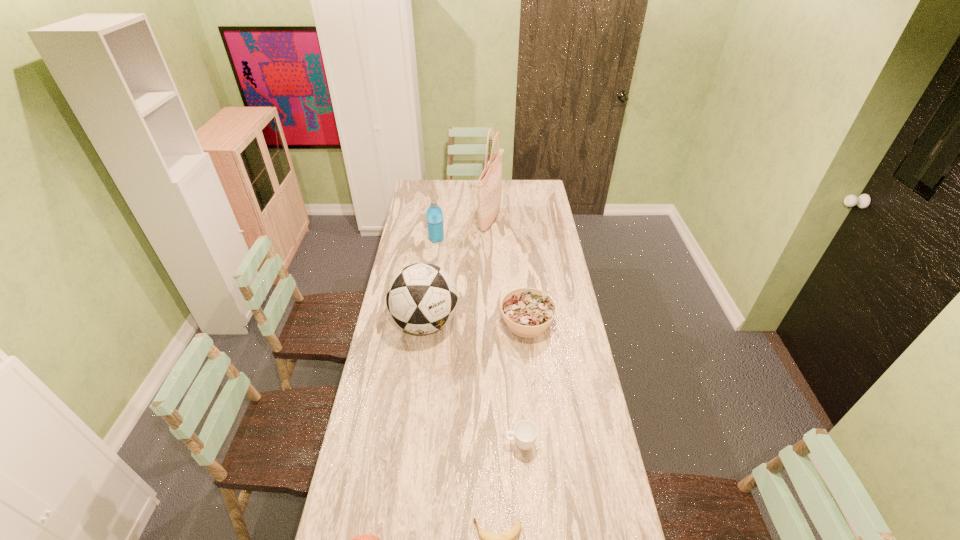
What are the coordinates of `the tallest object` in the screenshot? It's located at (489, 184).

The image size is (960, 540). In order to click on the farthest object in this screenshot , I will do `click(490, 140)`.

The width and height of the screenshot is (960, 540). I want to click on soccer ball, so click(x=422, y=298).

At what (x,y) coordinates should I click in order to perform the action: click on the fifth shortest object. Please return your answer as a coordinate pair (x, y). Looking at the image, I should click on (434, 213).

Image resolution: width=960 pixels, height=540 pixels. Find the location of `the fifth tallest object`. the fifth tallest object is located at coordinates (528, 312).

What are the coordinates of `cup` in the screenshot? It's located at (525, 432).

You are a GUI agent. You are given a task and a screenshot of the screen. Output one action in this format:
    pyautogui.click(x=<x>, y=<y>)
    Task: Click on the blank space located on the left of the tallest object
    
    Given the screenshot: What is the action you would take?
    pyautogui.click(x=412, y=221)

Where is `vacant area situated on the surface of the beer bottle`? The height and width of the screenshot is (540, 960). vacant area situated on the surface of the beer bottle is located at coordinates (474, 185).

Image resolution: width=960 pixels, height=540 pixels. I want to click on vacant region located 0.150m on the surface of the beer bottle, so tap(458, 185).

At what (x,y) coordinates should I click in order to perform the action: click on blank space located 0.310m on the surface of the beer bottle. Please return your answer as a coordinate pair (x, y). This screenshot has height=540, width=960. Looking at the image, I should click on (434, 185).